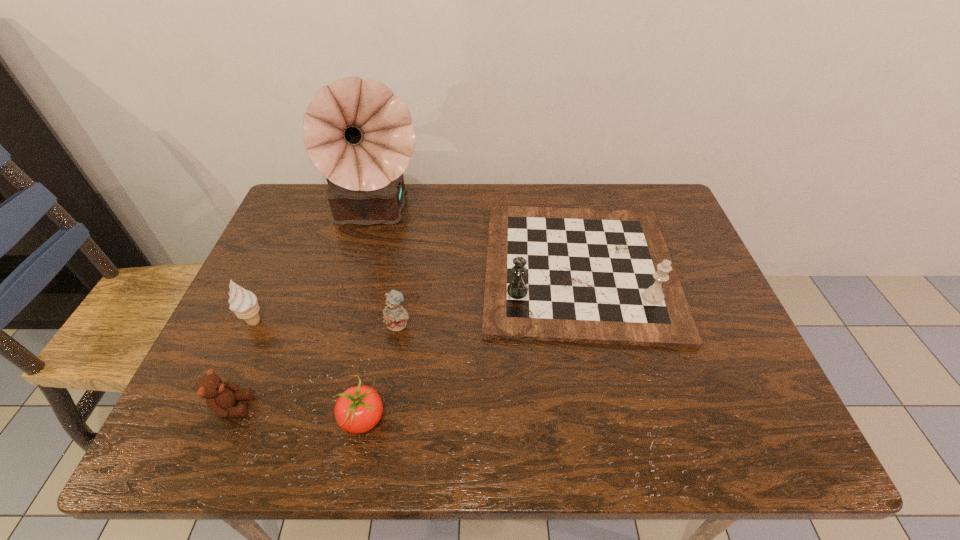
You are a GUI agent. You are given a task and a screenshot of the screen. Output one action in this format:
    pyautogui.click(x=<x>, y=<y>)
    Task: Click on the record player
    This screenshot has height=540, width=960.
    Given the screenshot: What is the action you would take?
    pyautogui.click(x=358, y=134)

Locate an element on the screen. The height and width of the screenshot is (540, 960). icecream is located at coordinates (243, 303).

I want to click on gameboard, so click(580, 275).

Locate an element on the screen. Image resolution: width=960 pixels, height=540 pixels. the right teddy bear is located at coordinates (395, 316).

Image resolution: width=960 pixels, height=540 pixels. What are the coordinates of `the left teddy bear` in the screenshot? It's located at (220, 396).

This screenshot has width=960, height=540. I want to click on the shortest object, so click(358, 409).

Image resolution: width=960 pixels, height=540 pixels. What are the coordinates of `free space located from the horn of the record player` in the screenshot? It's located at (358, 275).

Locate an element on the screen. Image resolution: width=960 pixels, height=540 pixels. vacant space situated on the front-facing side of the icecream is located at coordinates (416, 322).

Find the location of `free space located 0.270m on the left of the gameboard`. free space located 0.270m on the left of the gameboard is located at coordinates (379, 268).

This screenshot has width=960, height=540. Find the location of `vacant position located on the front-facing side of the right teddy bear`. vacant position located on the front-facing side of the right teddy bear is located at coordinates (378, 454).